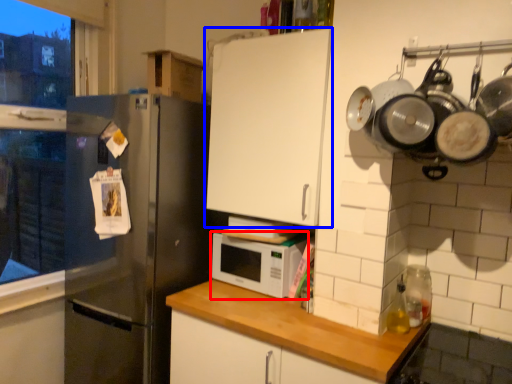
Question: Which of the following is the closest to the observer, microwave oven (highlighted by a red box) or cabinetry (highlighted by a blue box)?

Choices:
 (A) microwave oven
 (B) cabinetry

Answer: (B)